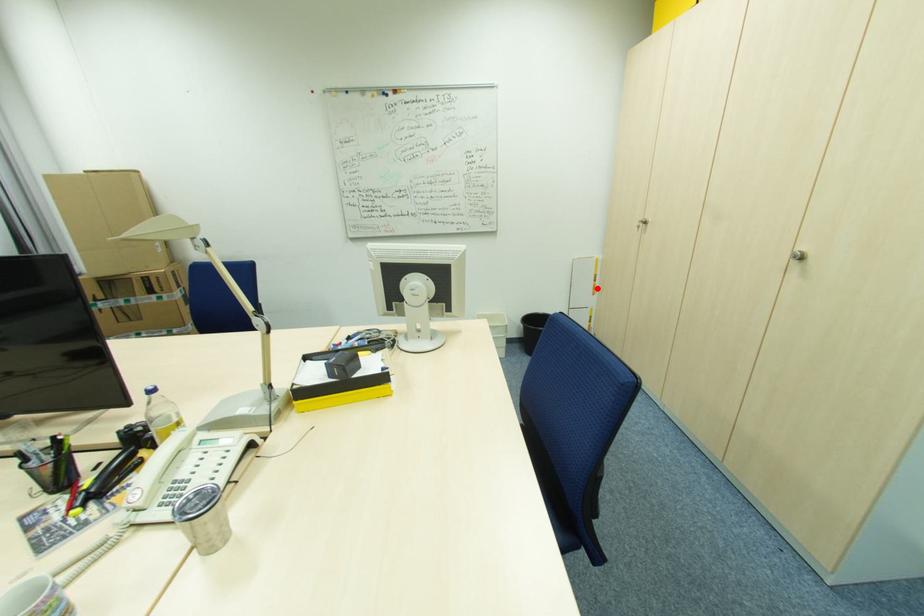
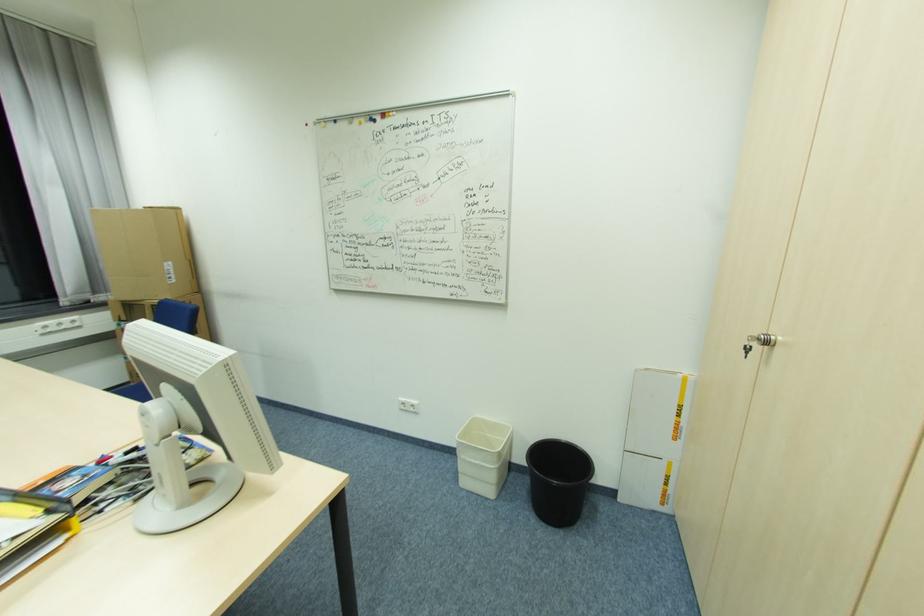
Question: A red point is marked in image1. In image2, is the corresponding 3D point closer to the camera or farther? Reply with the corresponding letter.

Choices:
 (A) The corresponding 3D point is closer.
 (B) The corresponding 3D point is farther.

Answer: (B)